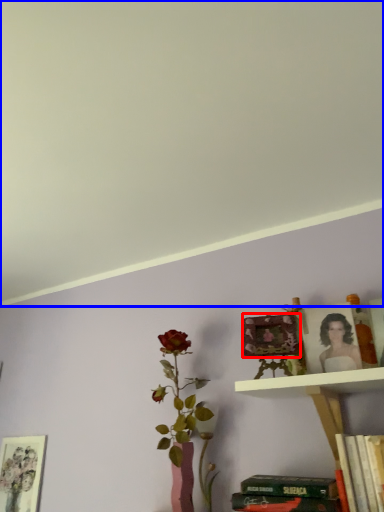
Question: Among these objects, which one is nearest to the camera, picture frame (highlighted by a red box) or backdrop (highlighted by a blue box)?

Choices:
 (A) picture frame
 (B) backdrop

Answer: (B)